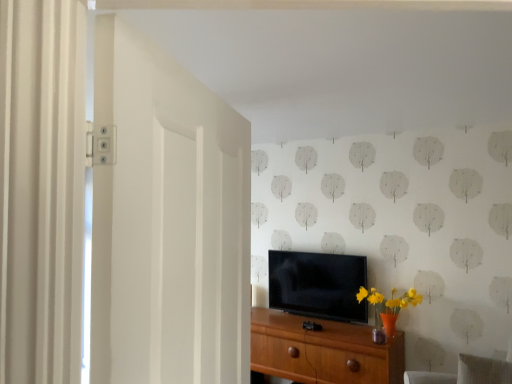
At what (x,y) coordinates should I click in order to perform the action: click on vacant location below black glossy tv at center (from a real-world perspective). Please return your answer as a coordinate pair (x, y). Image resolution: width=512 pixels, height=384 pixels. Looking at the image, I should click on (317, 314).